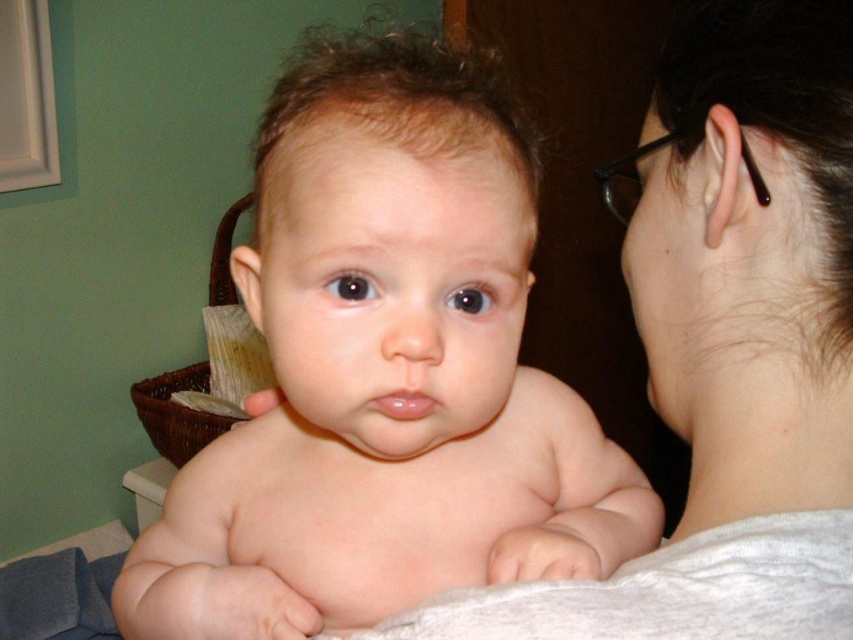
You are a pediatrician examining a baby. You notice the smooth skin baby at center and the white fabric at upper right. Which object is positioned lower in the image?

The smooth skin baby at center is positioned lower than the white fabric at upper right.

You are a photographer taking a close up of a baby. The baby is at the center of the image. To ensure the baby is in focus, you need to adjust your camera to focus on the exact center point of the image. Is the smooth skin baby at center located at the exact center of the image?

The smooth skin baby at center is located at point (x=386, y=372), which is slightly off the exact center of the image. The exact center would be at coordinates (x=426, y=320). Therefore, the baby is not perfectly centered.

You are a pediatrician examining a baby in an office. You notice the smooth skin baby at center and the white fabric at upper right in the room. Which object is located to the right of the other?

The smooth skin baby at center is positioned on the left side of white fabric at upper right, so the white fabric at upper right is to the right of the smooth skin baby at center.